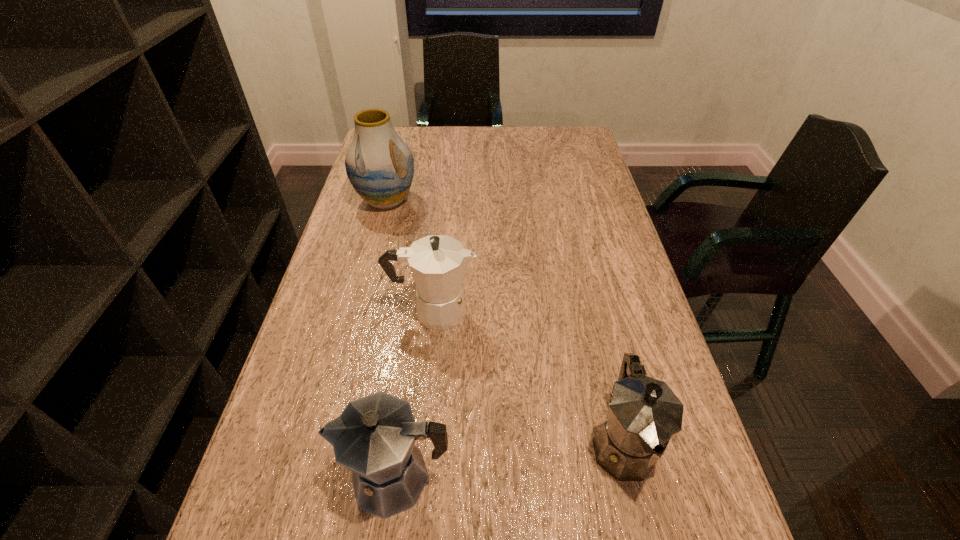
In the image, there is a desktop. Where is `vacant space at the left edge`? vacant space at the left edge is located at coordinates [x=380, y=254].

The height and width of the screenshot is (540, 960). What are the coordinates of `vacant space at the right edge of the desktop` in the screenshot? It's located at (616, 283).

Image resolution: width=960 pixels, height=540 pixels. In order to click on vacant space at the far right corner of the desktop in this screenshot , I will do `click(578, 149)`.

I want to click on vacant area that lies between the rightmost coffeepot and the vase, so click(x=504, y=322).

I want to click on free spot between the second farthest object and the rightmost object, so click(527, 377).

Locate an element on the screen. Image resolution: width=960 pixels, height=540 pixels. unoccupied position between the farthest coffeepot and the rightmost object is located at coordinates [527, 377].

This screenshot has width=960, height=540. Find the location of `free space between the tallest object and the rightmost object`. free space between the tallest object and the rightmost object is located at coordinates (504, 322).

Point out which object is positioned as the third nearest to the second farthest object. Please provide its 2D coordinates. Your answer should be formatted as a tuple, i.e. [(x, y)], where the tuple contains the x and y coordinates of a point satisfying the conditions above.

[(380, 166)]

Locate which object is the third closest to the rightmost coffeepot. Please provide its 2D coordinates. Your answer should be formatted as a tuple, i.e. [(x, y)], where the tuple contains the x and y coordinates of a point satisfying the conditions above.

[(380, 166)]

Select which coffeepot appears as the closest to the rightmost coffeepot. Please provide its 2D coordinates. Your answer should be formatted as a tuple, i.e. [(x, y)], where the tuple contains the x and y coordinates of a point satisfying the conditions above.

[(374, 437)]